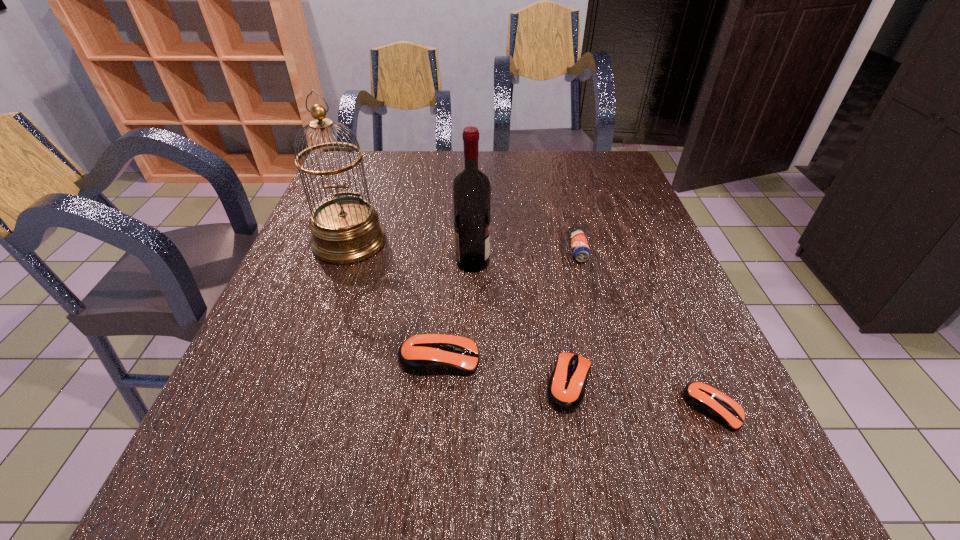
Locate an element on the screen. vacant area in the image that satisfies the following two spatial constraints: 1. on the front and back of the shortest computer mouse; 2. on the right side of the alcohol is located at coordinates (469, 409).

Locate an element on the screen. Image resolution: width=960 pixels, height=540 pixels. free spot that satisfies the following two spatial constraints: 1. with an open door on the beer can; 2. on the left side of the leftmost object is located at coordinates (347, 250).

You are a GUI agent. You are given a task and a screenshot of the screen. Output one action in this format:
    pyautogui.click(x=<x>, y=<y>)
    Task: Click on the vacant region that satisfies the following two spatial constraints: 1. on the front and back of the rightmost object; 2. on the right side of the alcohol
    
    Given the screenshot: What is the action you would take?
    pyautogui.click(x=469, y=409)